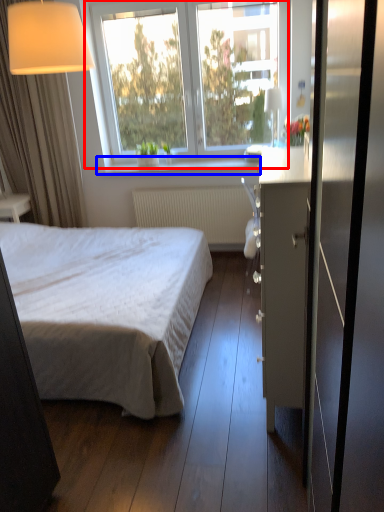
Question: Among these objects, which one is nearest to the camera, window (highlighted by a red box) or window sill (highlighted by a blue box)?

Choices:
 (A) window
 (B) window sill

Answer: (A)